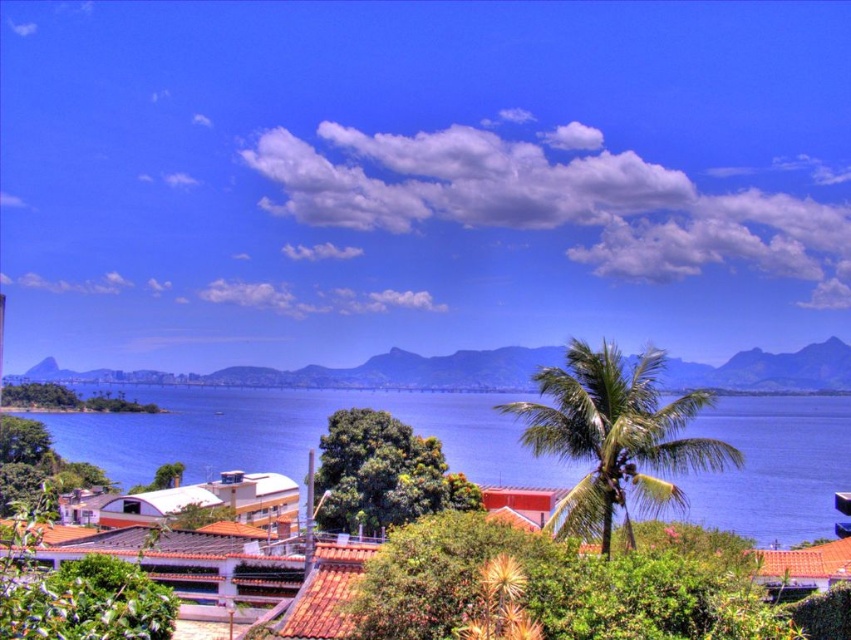
Question: Which point appears closest to the camera in this image?

Choices:
 (A) (669, 461)
 (B) (507, 396)

Answer: (A)

Question: Can you confirm if blue water at center is positioned below green leafy palm tree at center?

Choices:
 (A) no
 (B) yes

Answer: (B)

Question: Does blue water at center appear on the right side of green leafy palm tree at center?

Choices:
 (A) no
 (B) yes

Answer: (A)

Question: Is blue water at center wider than green leafy palm tree at center?

Choices:
 (A) no
 (B) yes

Answer: (B)

Question: Among these objects, which one is farthest from the camera?

Choices:
 (A) green leafy palm tree at center
 (B) blue water at center

Answer: (B)